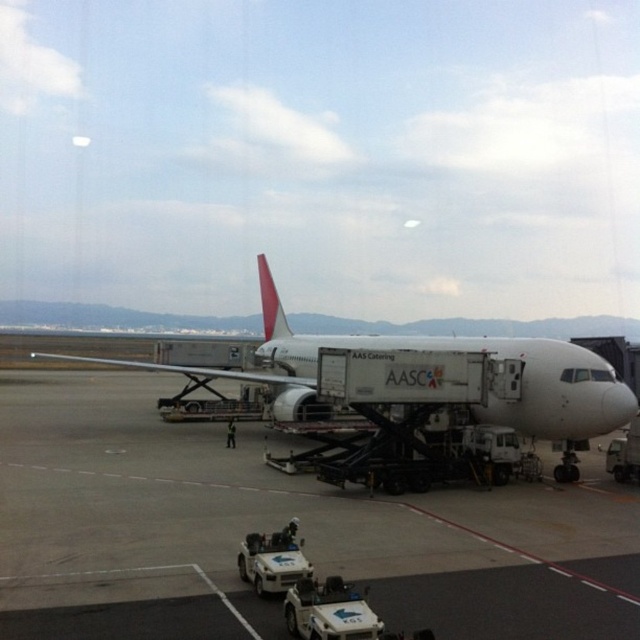
Question: Which of the following is the closest to the observer?

Choices:
 (A) (586, 387)
 (B) (138, 376)

Answer: (A)

Question: Which of the following is the farthest from the observer?

Choices:
 (A) white matte airplane at center
 (B) white matte tarmac at center

Answer: (A)

Question: Which object appears farthest from the camera in this image?

Choices:
 (A) white matte tarmac at center
 (B) white matte airplane at center

Answer: (B)

Question: Does white matte tarmac at center come behind white matte airplane at center?

Choices:
 (A) yes
 (B) no

Answer: (B)

Question: Can you confirm if white matte tarmac at center is wider than white matte airplane at center?

Choices:
 (A) no
 (B) yes

Answer: (A)

Question: Is white matte tarmac at center wider than white matte airplane at center?

Choices:
 (A) yes
 (B) no

Answer: (B)